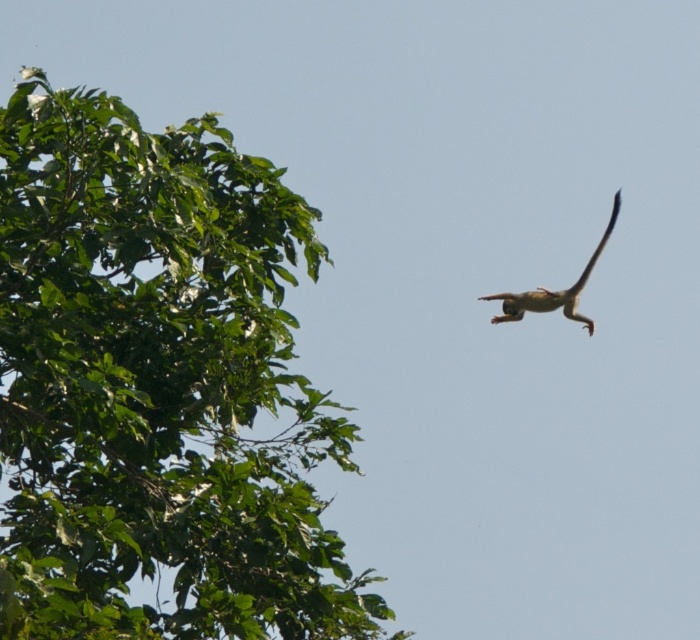
Is green leafy tree at upper left further to the viewer compared to brown furry monkey at upper right?

No, green leafy tree at upper left is in front of brown furry monkey at upper right.

Which is in front, point (141, 460) or point (578, 284)?

Point (141, 460) is in front.

Locate an element on the screen. green leafy tree at upper left is located at coordinates (158, 385).